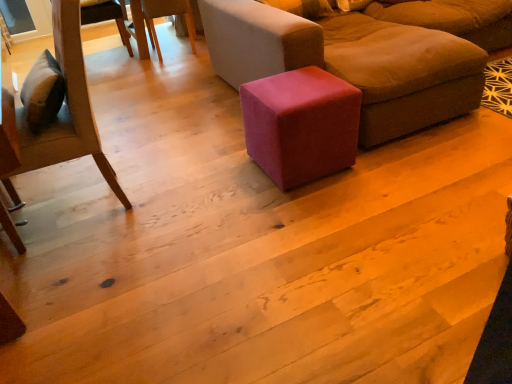
Where is `vacant space in front of velvet brown ottoman at center`? This screenshot has height=384, width=512. vacant space in front of velvet brown ottoman at center is located at coordinates (380, 219).